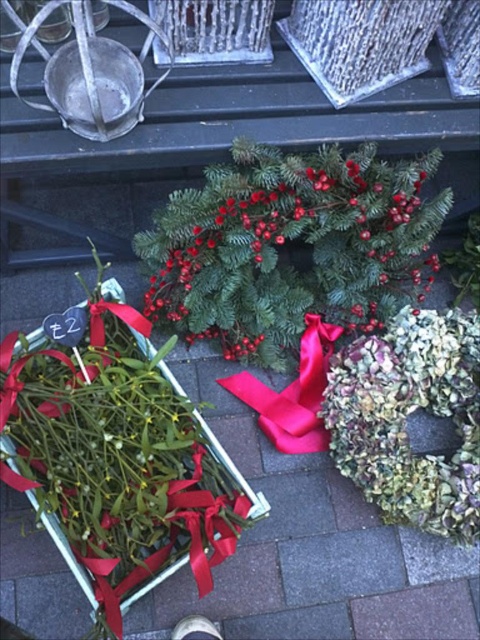
Is green matte wreath at center thinner than shiny red ribbon at center?

No.

Which of these two, green matte wreath at center or shiny red ribbon at center, stands taller?

Standing taller between the two is green matte wreath at center.

Is point (337, 228) closer to viewer compared to point (271, 428)?

Yes, point (337, 228) is closer to viewer.

The image size is (480, 640). What are the coordinates of `green matte wreath at center` in the screenshot? It's located at (291, 248).